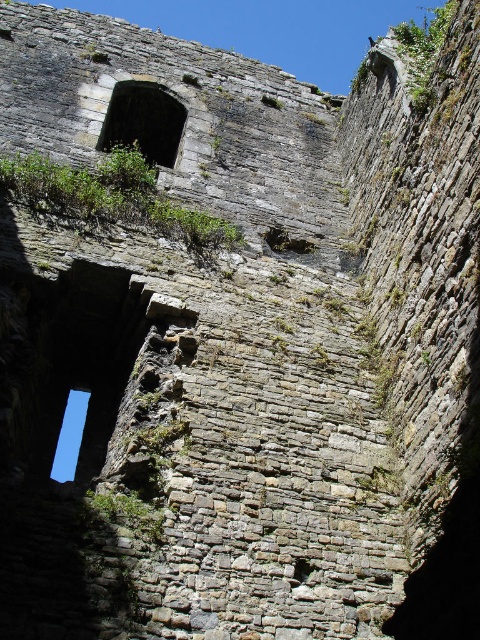
Can you confirm if stone textured window at upper center is wider than transparent glass window at upper left?

No, stone textured window at upper center is not wider than transparent glass window at upper left.

Is point (136, 132) positioned behind point (57, 458)?

No, it is not.

Is point (120, 138) farther from viewer compared to point (66, 468)?

No.

This screenshot has width=480, height=640. Identify the location of stone textured window at upper center. pos(144,122).

Is green mossy wall at upper center wider than stone textured window at upper center?

Indeed, green mossy wall at upper center has a greater width compared to stone textured window at upper center.

Can you confirm if green mossy wall at upper center is positioned to the left of stone textured window at upper center?

No, green mossy wall at upper center is not to the left of stone textured window at upper center.

I want to click on green mossy wall at upper center, so click(112, 196).

I want to click on green mossy wall at upper center, so click(112, 196).

How distant is green mossy wall at upper center from transparent glass window at upper left?

They are 108.91 feet apart.

Who is taller, green mossy wall at upper center or transparent glass window at upper left?

With more height is transparent glass window at upper left.

Is point (80, 180) closer to viewer compared to point (72, 392)?

Yes, point (80, 180) is closer to viewer.

Identify the location of green mossy wall at upper center. (112, 196).